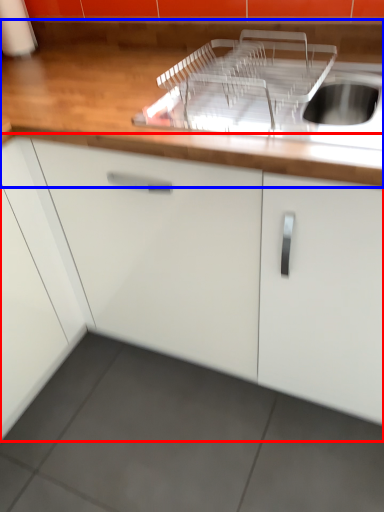
Question: Which point is closer to the camera, cabinetry (highlighted by a red box) or countertop (highlighted by a blue box)?

Choices:
 (A) cabinetry
 (B) countertop

Answer: (A)